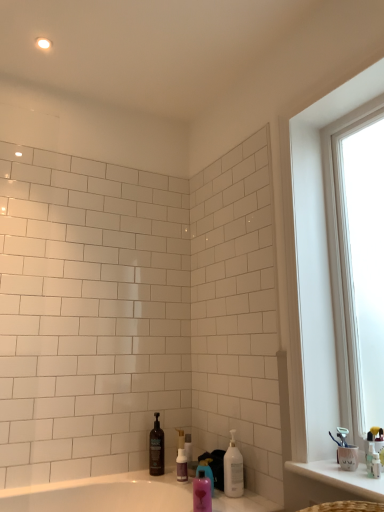
Question: Considering the relative positions of clear plastic bottle at center, arranged as the second toiletry when viewed from the right, and white plastic toothbrush at right, the 1th toiletry in the front-to-back sequence, in the image provided, is clear plastic bottle at center, arranged as the second toiletry when viewed from the right, to the left of white plastic toothbrush at right, the 1th toiletry in the front-to-back sequence, from the viewer's perspective?

Choices:
 (A) no
 (B) yes

Answer: (B)

Question: Does clear plastic bottle at center, acting as the 1th toiletry starting from the back, have a smaller size compared to white plastic toothbrush at right, the 1th toiletry in the front-to-back sequence?

Choices:
 (A) no
 (B) yes

Answer: (A)

Question: From a real-world perspective, is clear plastic bottle at center, the first toiletry ordered from the bottom, below white plastic toothbrush at right, which is the first toiletry in right-to-left order?

Choices:
 (A) yes
 (B) no

Answer: (A)

Question: Is clear plastic bottle at center, arranged as the third toiletry when viewed from the front, wider than white plastic toothbrush at right, which is the first toiletry in right-to-left order?

Choices:
 (A) no
 (B) yes

Answer: (B)

Question: Are clear plastic bottle at center, the first toiletry ordered from the bottom, and white plastic toothbrush at right, the 1th toiletry in the top-to-bottom sequence, far apart?

Choices:
 (A) no
 (B) yes

Answer: (B)

Question: Is translucent purple bottle at lower center, which is counted as the 2th toiletry, starting from the top, wider or thinner than clear plastic bottle at center, which ranks as the second toiletry in left-to-right order?

Choices:
 (A) wide
 (B) thin

Answer: (A)

Question: From a real-world perspective, is translucent purple bottle at lower center, acting as the first toiletry starting from the left, above or below clear plastic bottle at center, the first toiletry ordered from the bottom?

Choices:
 (A) below
 (B) above

Answer: (A)

Question: Relative to clear plastic bottle at center, acting as the 1th toiletry starting from the back, is translucent purple bottle at lower center, the 2th toiletry ordered from the bottom, in front or behind?

Choices:
 (A) behind
 (B) front

Answer: (B)

Question: Considering the positions of point (180, 480) and point (183, 449), is point (180, 480) closer or farther from the camera than point (183, 449)?

Choices:
 (A) farther
 (B) closer

Answer: (B)

Question: Considering the positions of clear plastic bottle at center, acting as the 1th toiletry starting from the back, and pink glossy mouthwash at lower center in the image, is clear plastic bottle at center, acting as the 1th toiletry starting from the back, bigger or smaller than pink glossy mouthwash at lower center?

Choices:
 (A) big
 (B) small

Answer: (B)

Question: Considering the positions of clear plastic bottle at center, which ranks as the second toiletry in left-to-right order, and pink glossy mouthwash at lower center in the image, is clear plastic bottle at center, which ranks as the second toiletry in left-to-right order, wider or thinner than pink glossy mouthwash at lower center?

Choices:
 (A) thin
 (B) wide

Answer: (A)

Question: Is clear plastic bottle at center, which is the 3th toiletry in top-to-bottom order, in front of or behind pink glossy mouthwash at lower center in the image?

Choices:
 (A) behind
 (B) front

Answer: (A)

Question: Considering the relative positions of clear plastic bottle at center, which is the 3th toiletry in top-to-bottom order, and pink glossy mouthwash at lower center in the image provided, is clear plastic bottle at center, which is the 3th toiletry in top-to-bottom order, to the left or to the right of pink glossy mouthwash at lower center?

Choices:
 (A) right
 (B) left

Answer: (B)

Question: From the image's perspective, is pink glossy mouthwash at lower center located above or below white plastic toothbrush at right, the 1th toiletry in the front-to-back sequence?

Choices:
 (A) below
 (B) above

Answer: (A)

Question: Is pink glossy mouthwash at lower center spatially inside white plastic toothbrush at right, which is the first toiletry in right-to-left order, or outside of it?

Choices:
 (A) outside
 (B) inside

Answer: (A)